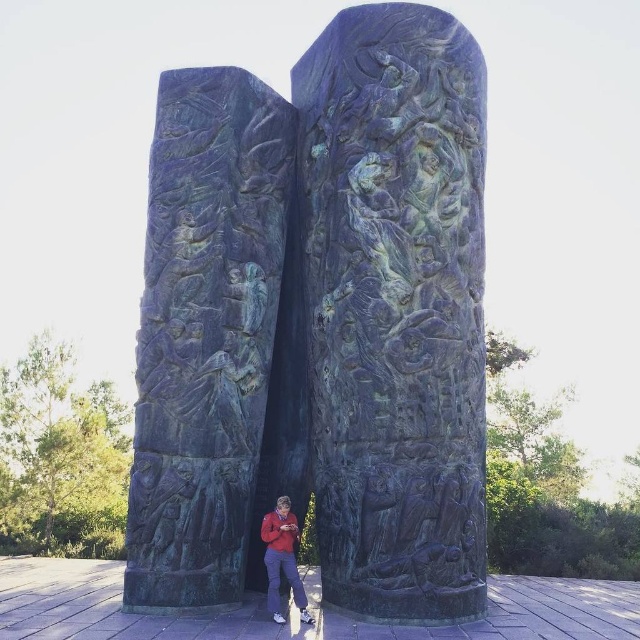
Which is in front, point (356, 259) or point (300, 593)?

Point (300, 593)

Who is lower down, green patina stone carving at center or matte red jacket at lower center?

matte red jacket at lower center is below.

From the picture: Measure the distance between point (349, 148) and camera.

They are 9.27 meters apart.

At what (x,y) coordinates should I click in order to perform the action: click on green patina stone carving at center. Please return your answer as a coordinate pair (x, y). This screenshot has width=640, height=640. Looking at the image, I should click on (396, 308).

Who is more distant from viewer, (195, 77) or (282, 522)?

The point (195, 77) is behind.

Locate an element on the screen. The width and height of the screenshot is (640, 640). green patinated stone relief at center is located at coordinates (205, 333).

Does point (172, 556) come in front of point (294, 592)?

No, (172, 556) is behind (294, 592).

This screenshot has height=640, width=640. I want to click on green patinated stone relief at center, so click(205, 333).

Is point (456, 502) less distant than point (148, 442)?

Yes, it is.

Which is more to the left, green patina stone carving at center or green patinated stone relief at center?

green patinated stone relief at center

Is point (371, 429) positioned after point (236, 340)?

No, (371, 429) is in front of (236, 340).

Find the location of a particular element. This screenshot has height=640, width=640. green patina stone carving at center is located at coordinates (396, 308).